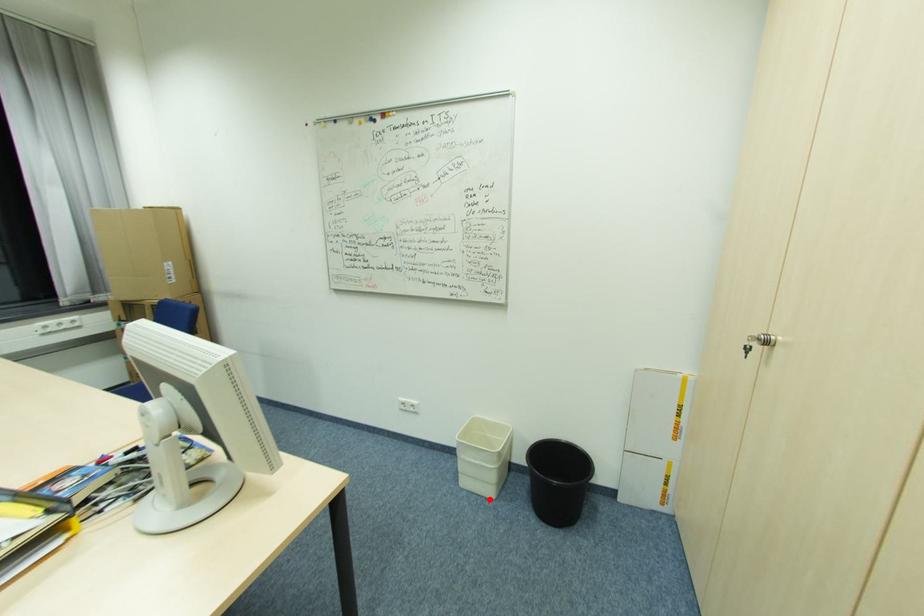
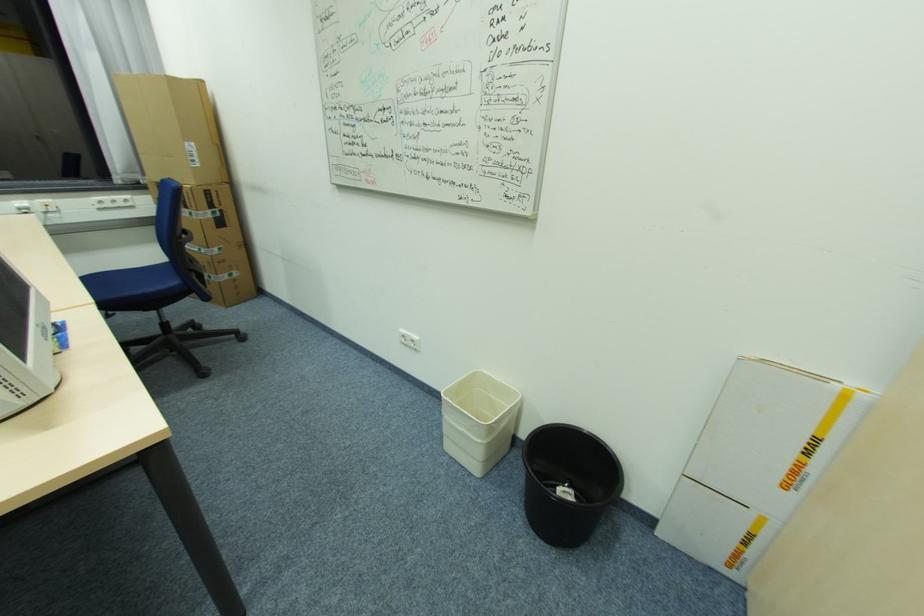
The point at the highlighted location is marked in the first image. Where is the corresponding point in the second image?

(472, 475)